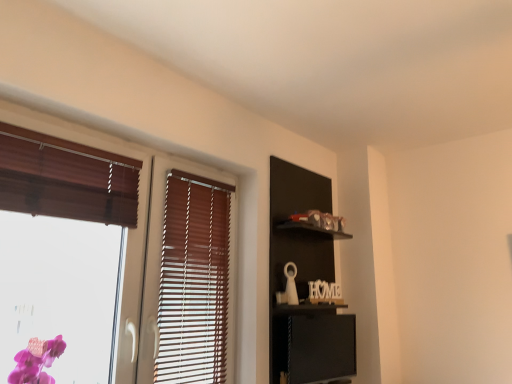
You are a GUI agent. You are given a task and a screenshot of the screen. Output one action in this format:
    pyautogui.click(x=<x>, y=<y>)
    Task: Click on the black matte shelf at upper right
    This screenshot has height=384, width=512.
    Given the screenshot: What is the action you would take?
    pyautogui.click(x=305, y=283)

What do you see at coordinates (305, 283) in the screenshot? I see `black matte shelf at upper right` at bounding box center [305, 283].

Image resolution: width=512 pixels, height=384 pixels. Describe the element at coordinates (64, 246) in the screenshot. I see `wooden blinds at left` at that location.

The height and width of the screenshot is (384, 512). Find the location of `wooden blinds at left`. wooden blinds at left is located at coordinates (64, 246).

I want to click on black matte shelf at upper right, so point(305,283).

Can you confirm if black matte shelf at upper right is positioned to the right of wooden blinds at left?

Yes, black matte shelf at upper right is to the right of wooden blinds at left.

Is black matte shelf at upper right positioned in front of wooden blinds at left?

No, black matte shelf at upper right is further to the viewer.

Which point is more distant from viewer, (314, 318) or (83, 218)?

The point (314, 318) is behind.

From the image's perspective, which is above, black matte shelf at upper right or wooden blinds at left?

wooden blinds at left.

From a real-world perspective, between black matte shelf at upper right and wooden blinds at left, who is vertically lower?

From a 3D spatial view, black matte shelf at upper right is below.

In terms of width, does black matte shelf at upper right look wider or thinner when compared to wooden blinds at left?

Clearly, black matte shelf at upper right has more width compared to wooden blinds at left.

Considering the sizes of black matte shelf at upper right and wooden blinds at left in the image, is black matte shelf at upper right taller or shorter than wooden blinds at left?

black matte shelf at upper right is taller than wooden blinds at left.

Which of these two, black matte shelf at upper right or wooden blinds at left, is bigger?

With larger size is black matte shelf at upper right.

Is black matte shelf at upper right spatially inside wooden blinds at left, or outside of it?

black matte shelf at upper right is spatially situated outside wooden blinds at left.

From the picture: Is black matte shelf at upper right not close to wooden blinds at left?

No, there isn't a large distance between black matte shelf at upper right and wooden blinds at left.

Is black matte shelf at upper right looking in the opposite direction of wooden blinds at left?

No, black matte shelf at upper right's orientation is not away from wooden blinds at left.

What's the angular difference between black matte shelf at upper right and wooden blinds at left's facing directions?

The facing directions of black matte shelf at upper right and wooden blinds at left are 0.293 degrees apart.

You are a GUI agent. You are given a task and a screenshot of the screen. Output one action in this format:
    pyautogui.click(x=<x>, y=<y>)
    Task: Click on the dresser located behind the wooden blinds at left
    
    Given the screenshot: What is the action you would take?
    pyautogui.click(x=305, y=283)

Which is more to the left, wooden blinds at left or black matte shelf at upper right?

wooden blinds at left.

In the scene shown: Is wooden blinds at left in front of or behind black matte shelf at upper right in the image?

wooden blinds at left is in front of black matte shelf at upper right.

Is point (81, 159) closer to camera compared to point (282, 237)?

Yes, it is.

From the image's perspective, relative to black matte shelf at upper right, is wooden blinds at left above or below?

wooden blinds at left is situated higher than black matte shelf at upper right in the image.

From a real-world perspective, is wooden blinds at left positioned under black matte shelf at upper right based on gravity?

Incorrect, from a real-world perspective, wooden blinds at left is higher than black matte shelf at upper right.

In terms of width, does wooden blinds at left look wider or thinner when compared to black matte shelf at upper right?

Clearly, wooden blinds at left has less width compared to black matte shelf at upper right.

Considering the sizes of objects wooden blinds at left and black matte shelf at upper right in the image provided, who is taller, wooden blinds at left or black matte shelf at upper right?

With more height is black matte shelf at upper right.

Considering the relative sizes of wooden blinds at left and black matte shelf at upper right in the image provided, is wooden blinds at left smaller than black matte shelf at upper right?

Yes.

Is black matte shelf at upper right surrounded by wooden blinds at left?

No, black matte shelf at upper right is not surrounded by wooden blinds at left.

Is wooden blinds at left far away from black matte shelf at upper right?

wooden blinds at left is actually quite close to black matte shelf at upper right.

Is wooden blinds at left turned away from black matte shelf at upper right?

No, wooden blinds at left is not facing away from black matte shelf at upper right.

Where is `window that is on the left side of black matte shelf at upper right`? window that is on the left side of black matte shelf at upper right is located at coordinates (64, 246).

This screenshot has width=512, height=384. In order to click on dresser that is on the right side of wooden blinds at left in this screenshot , I will do `click(305, 283)`.

This screenshot has width=512, height=384. I want to click on dresser behind the wooden blinds at left, so click(x=305, y=283).